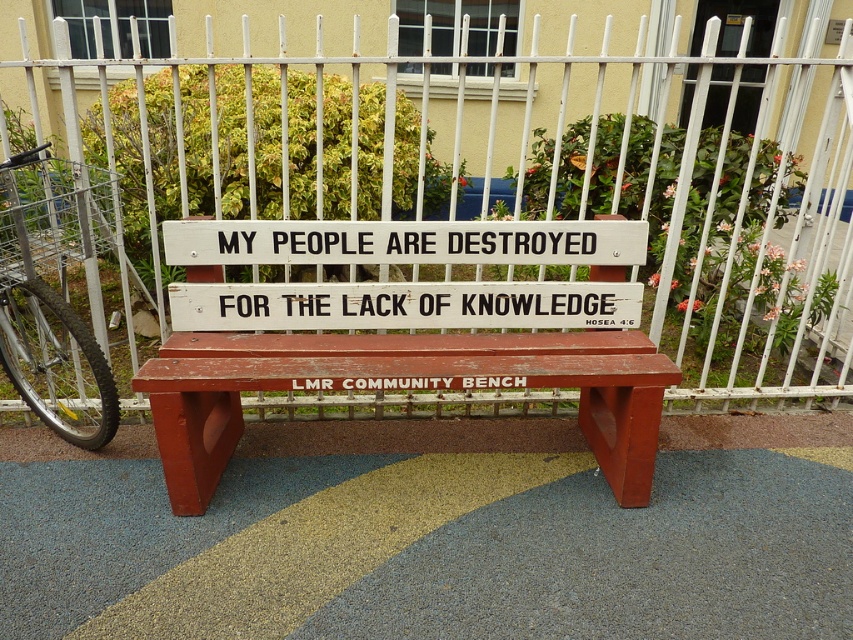
You are a painter who needs to place a ladder between the wooden bench at center and the silver metallic bicycle at left. Which object should the ladder be placed closer to if you want to reach the bicycle first?

The wooden bench at center is not as tall as the silver metallic bicycle at left, so the ladder should be placed closer to the silver metallic bicycle at left to reach it first.

You are a painter who needs to place a 6 inch wide canvas between the wooden bench at center and the white wood sign at center. Can you fit it there?

The distance between the wooden bench at center and the white wood sign at center is 5.88 inches, so the 6 inch wide canvas cannot fit as it is slightly wider than the available space.